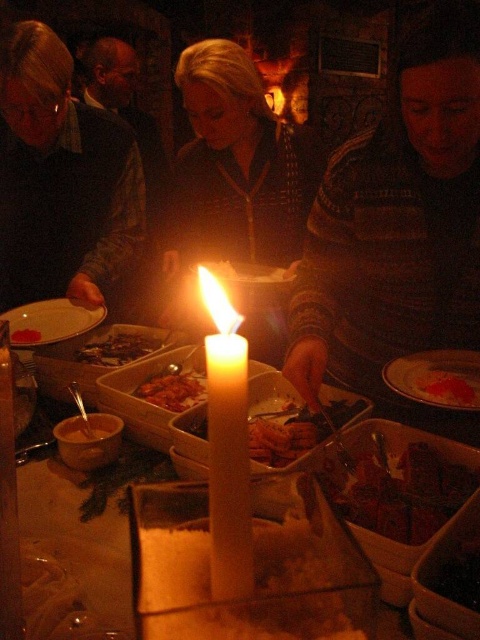
Question: Which point is closer to the camera?

Choices:
 (A) striped sweater at center
 (B) shiny red sauce at center

Answer: (A)

Question: Which object is positioned farthest from the matte white plate at lower left?

Choices:
 (A) smooth white cheese at center
 (B) white matte candle at center

Answer: (B)

Question: Does matte black sweater at left have a smaller size compared to smooth red sauce at center?

Choices:
 (A) yes
 (B) no

Answer: (B)

Question: Considering the relative positions of shiny red sauce at center and matte brown bowl at center in the image provided, where is shiny red sauce at center located with respect to matte brown bowl at center?

Choices:
 (A) right
 (B) left

Answer: (A)

Question: Can you confirm if dark chocolate bar at center is wider than smooth chocolate bar at center?

Choices:
 (A) yes
 (B) no

Answer: (A)

Question: Which point is closer to the camera taking this photo?

Choices:
 (A) (96, 426)
 (B) (404, 465)

Answer: (B)